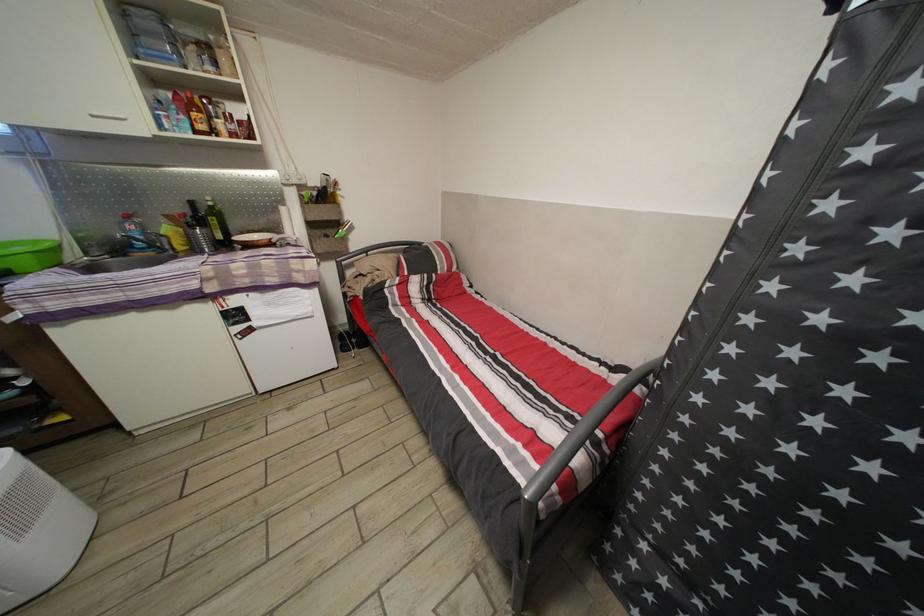
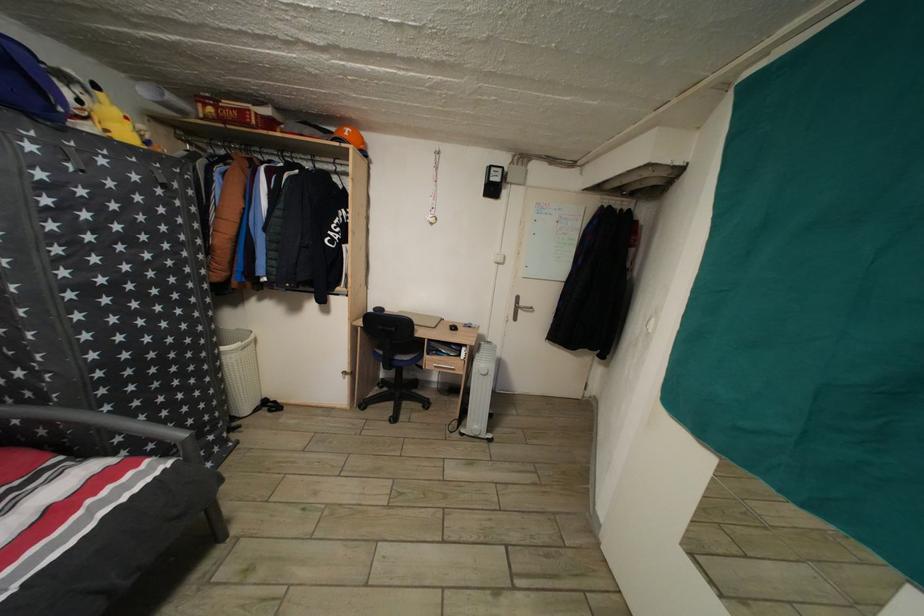
In the second image, find the point that corresponds to point 526,452 in the first image.

(96, 508)